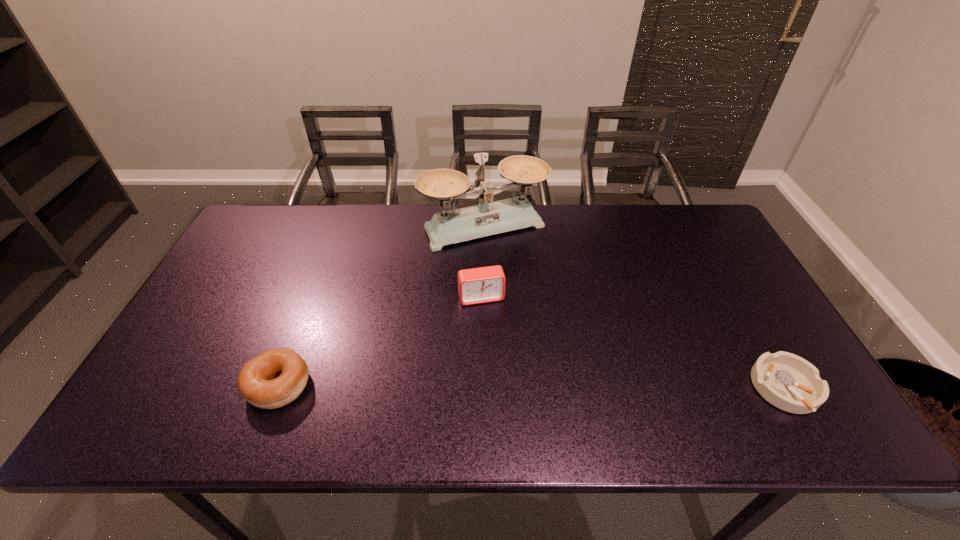
Where is `free space on the desktop that is between the leftmost object and the ashtray and is positioned on the front-facing side of the alarm clock`? This screenshot has width=960, height=540. free space on the desktop that is between the leftmost object and the ashtray and is positioned on the front-facing side of the alarm clock is located at coordinates (504, 387).

I want to click on vacant space on the desktop that is between the second shortest object and the shortest object and is positioned on the front-facing side of the farthest object, so click(578, 387).